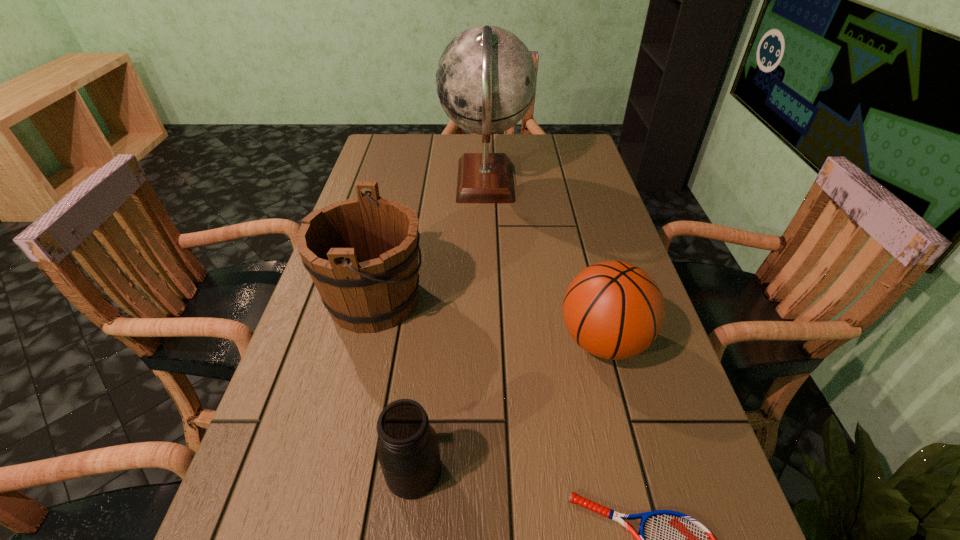
Where is `vacant position in the image that satisfies the following two spatial constraints: 1. on the side of the second tallest object with the handle for carrying; 2. on the back side of the second shortest object`? The height and width of the screenshot is (540, 960). vacant position in the image that satisfies the following two spatial constraints: 1. on the side of the second tallest object with the handle for carrying; 2. on the back side of the second shortest object is located at coordinates (332, 471).